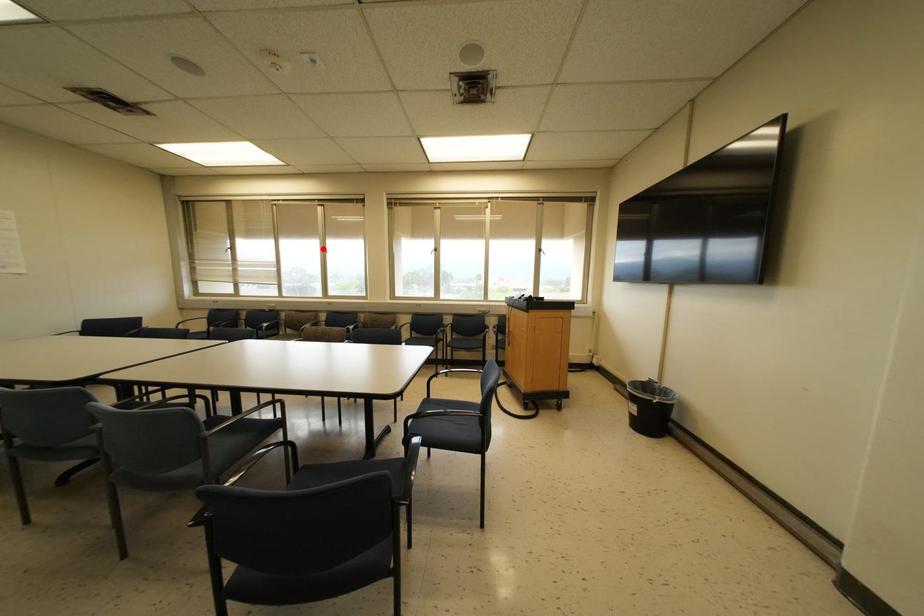
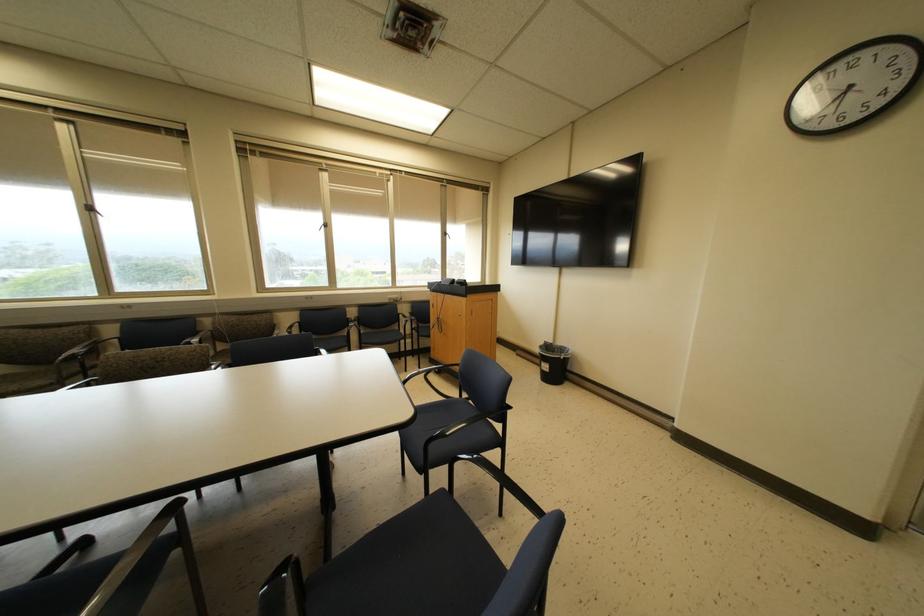
In the second image, find the point that corresponds to the highlighted location in the first image.

(89, 208)